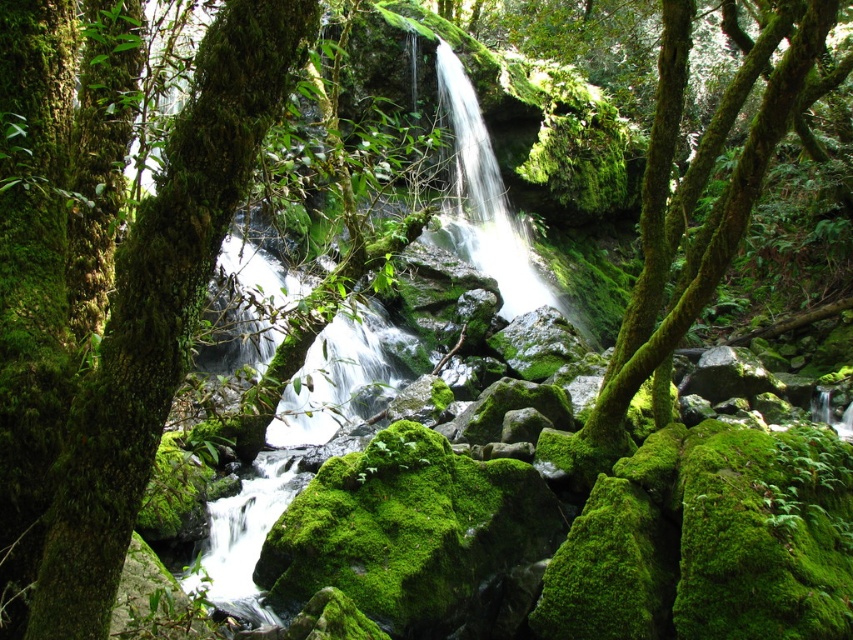
Question: Which object is the closest to the green mossy tree at left?

Choices:
 (A) white frothy water at center
 (B) green mossy tree at center

Answer: (B)

Question: Does green mossy tree at center appear over white frothy water at center?

Choices:
 (A) no
 (B) yes

Answer: (B)

Question: Is green mossy tree at left closer to the viewer compared to green mossy tree at center?

Choices:
 (A) yes
 (B) no

Answer: (A)

Question: Among these objects, which one is nearest to the camera?

Choices:
 (A) green mossy tree at left
 (B) green mossy tree at center
 (C) white frothy water at center

Answer: (A)

Question: Among these objects, which one is farthest from the camera?

Choices:
 (A) green mossy tree at left
 (B) white frothy water at center
 (C) green mossy tree at center

Answer: (B)

Question: Can you confirm if green mossy tree at left is positioned below green mossy tree at center?

Choices:
 (A) yes
 (B) no

Answer: (A)